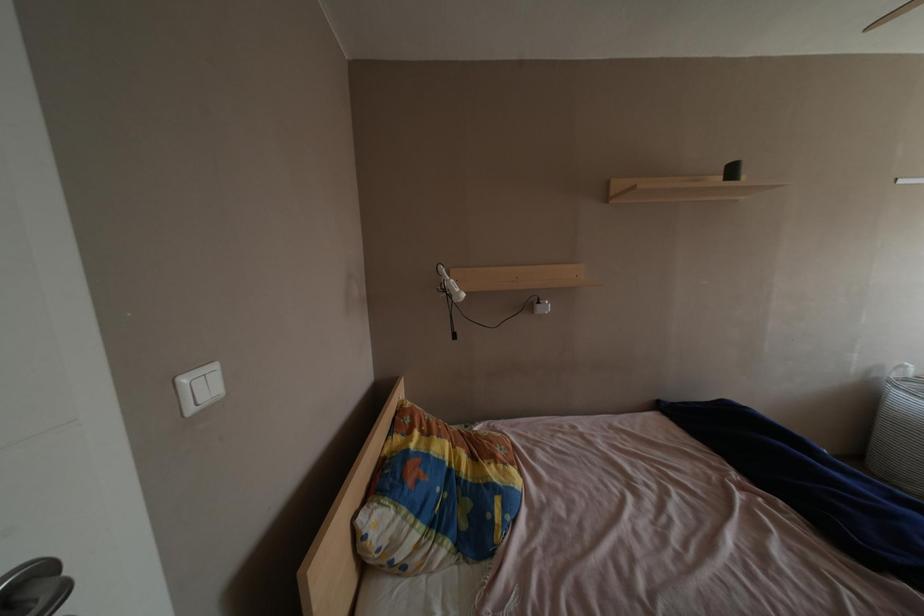
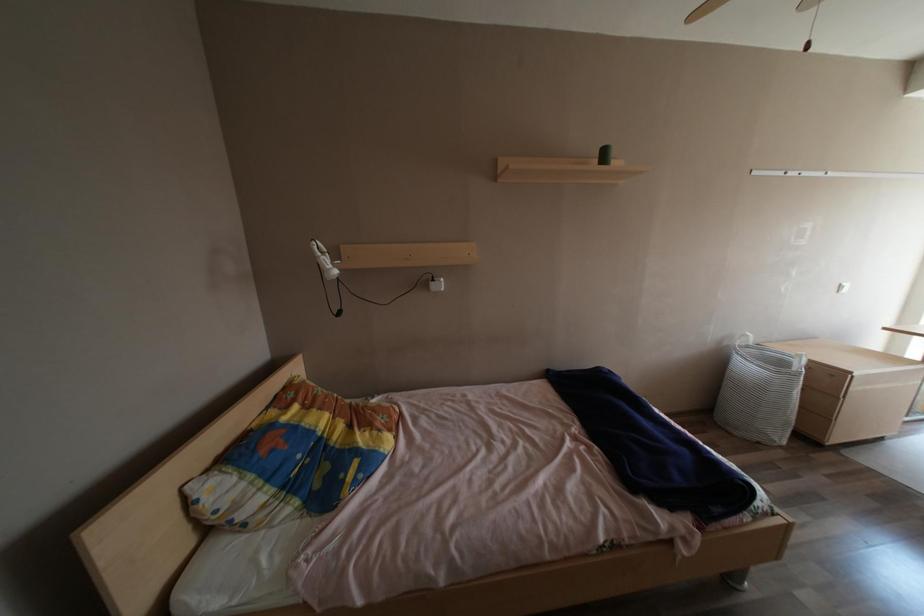
Question: Which direction would the cameraman need to move to produce the second image? Reply with the corresponding letter.

Choices:
 (A) Left
 (B) Right
 (C) Forward
 (D) Backward

Answer: (B)